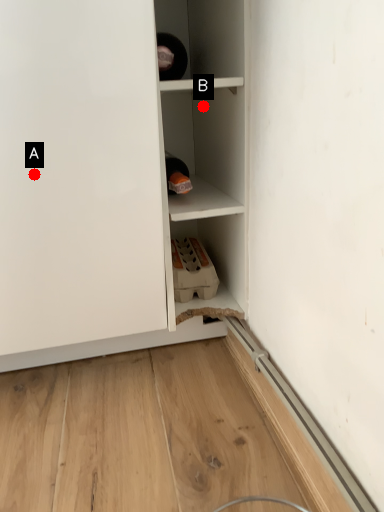
Question: Two points are circled on the image, labeled by A and B beside each circle. Which point is further to the camera?

Choices:
 (A) A is further
 (B) B is further

Answer: (B)